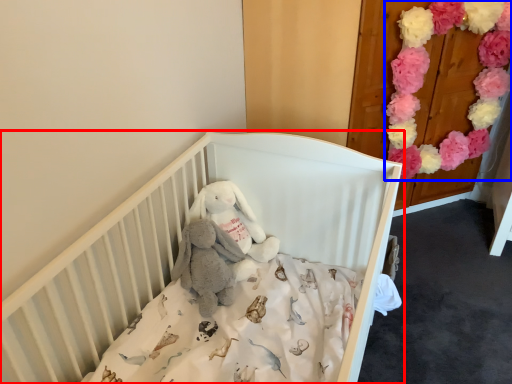
Question: Which object appears closest to the camera in this image, infant bed (highlighted by a red box) or flower (highlighted by a blue box)?

Choices:
 (A) infant bed
 (B) flower

Answer: (A)